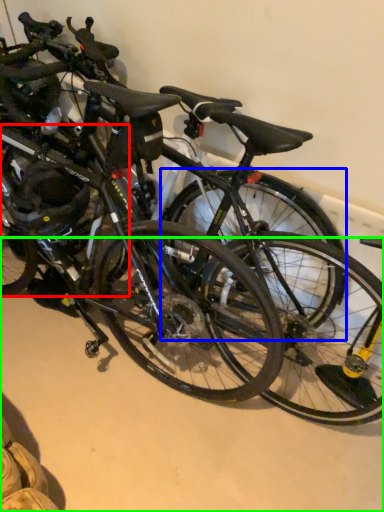
Question: Which object is the closest to the bicycle wheel (highlighted by a red box)? Choose among these: bicycle wheel (highlighted by a blue box) or concrete (highlighted by a green box).

Choices:
 (A) bicycle wheel
 (B) concrete

Answer: (A)